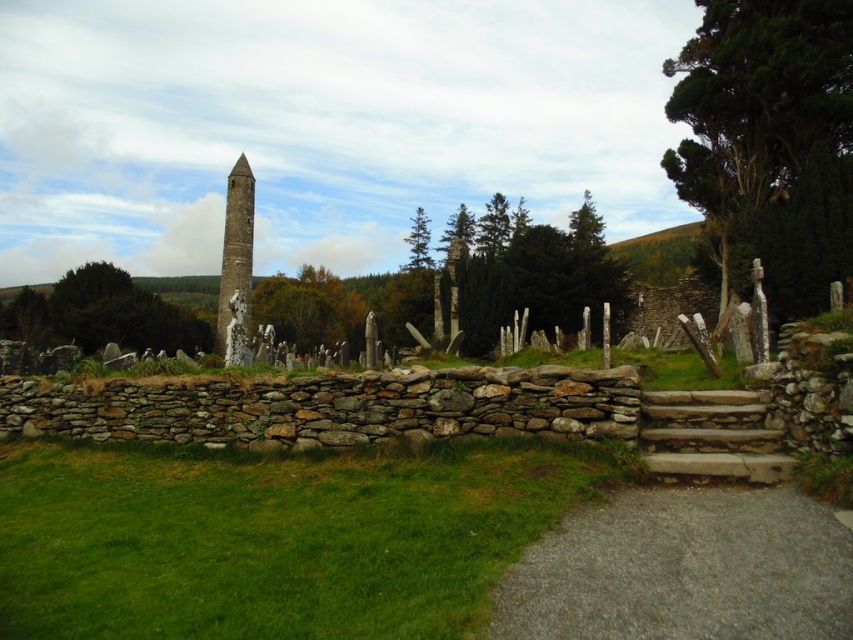
You are a gardener who needs to water the green grass at lower left and the green leafy tree at left. If your watering can holds enough water for 50 meters of travel, can you water both without refilling?

The distance between the green grass at lower left and the green leafy tree at left is 56.17 meters. Since your watering can only holds enough for 50 meters of travel, you would need to refill before watering both.